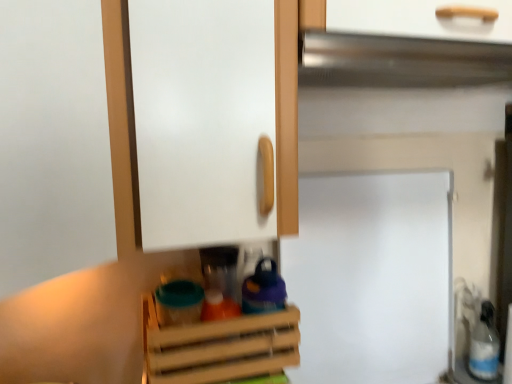
Question: From a real-world perspective, is silver metallic exhaust hood at upper center beneath white plastic bottle at lower right?

Choices:
 (A) yes
 (B) no

Answer: (B)

Question: Considering the relative sizes of silver metallic exhaust hood at upper center and white plastic bottle at lower right in the image provided, is silver metallic exhaust hood at upper center thinner than white plastic bottle at lower right?

Choices:
 (A) yes
 (B) no

Answer: (B)

Question: From a real-world perspective, is silver metallic exhaust hood at upper center on top of white plastic bottle at lower right?

Choices:
 (A) no
 (B) yes

Answer: (B)

Question: Does silver metallic exhaust hood at upper center have a lesser height compared to white plastic bottle at lower right?

Choices:
 (A) yes
 (B) no

Answer: (A)

Question: Is silver metallic exhaust hood at upper center at the left side of white plastic bottle at lower right?

Choices:
 (A) yes
 (B) no

Answer: (A)

Question: Relative to silver metallic exhaust hood at upper center, is white plastic bottle at lower right in front or behind?

Choices:
 (A) behind
 (B) front

Answer: (A)

Question: From a real-world perspective, is white plastic bottle at lower right physically located above or below silver metallic exhaust hood at upper center?

Choices:
 (A) below
 (B) above

Answer: (A)

Question: Looking at their shapes, would you say white plastic bottle at lower right is wider or thinner than silver metallic exhaust hood at upper center?

Choices:
 (A) thin
 (B) wide

Answer: (A)

Question: Based on their sizes in the image, would you say white plastic bottle at lower right is bigger or smaller than silver metallic exhaust hood at upper center?

Choices:
 (A) big
 (B) small

Answer: (B)

Question: From a real-world perspective, is white matte fridge at center positioned above or below wooden crate at center?

Choices:
 (A) above
 (B) below

Answer: (A)

Question: From the image's perspective, is white matte fridge at center above or below wooden crate at center?

Choices:
 (A) below
 (B) above

Answer: (B)

Question: Does point (361, 185) appear closer or farther from the camera than point (160, 334)?

Choices:
 (A) farther
 (B) closer

Answer: (A)

Question: Considering the positions of white matte fridge at center and wooden crate at center in the image, is white matte fridge at center taller or shorter than wooden crate at center?

Choices:
 (A) tall
 (B) short

Answer: (A)

Question: Looking at the image, does silver metallic exhaust hood at upper center seem bigger or smaller compared to wooden crate at center?

Choices:
 (A) big
 (B) small

Answer: (A)

Question: Is silver metallic exhaust hood at upper center to the left or to the right of wooden crate at center in the image?

Choices:
 (A) right
 (B) left

Answer: (A)